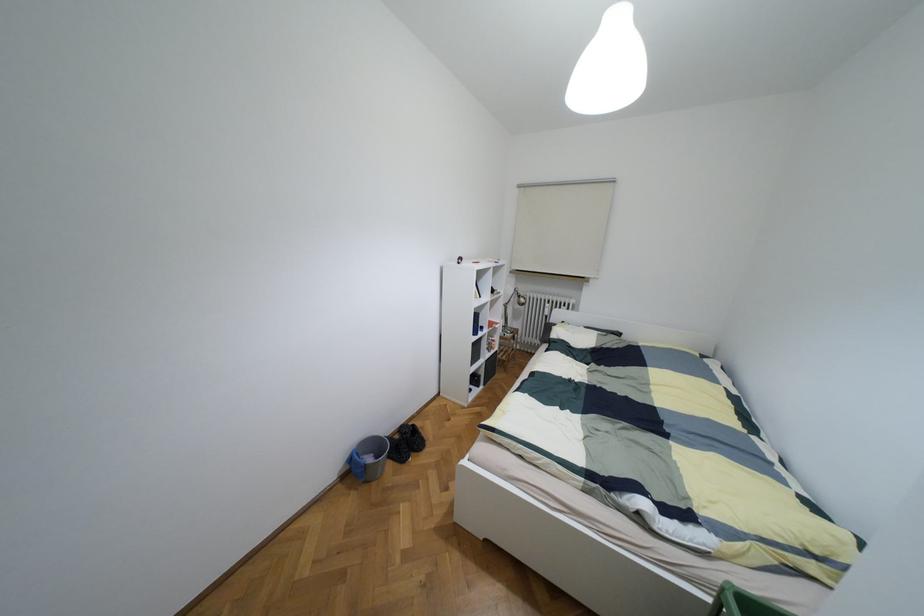
The location [369,458] corresponds to which object?

This point indicates the grey bucket.